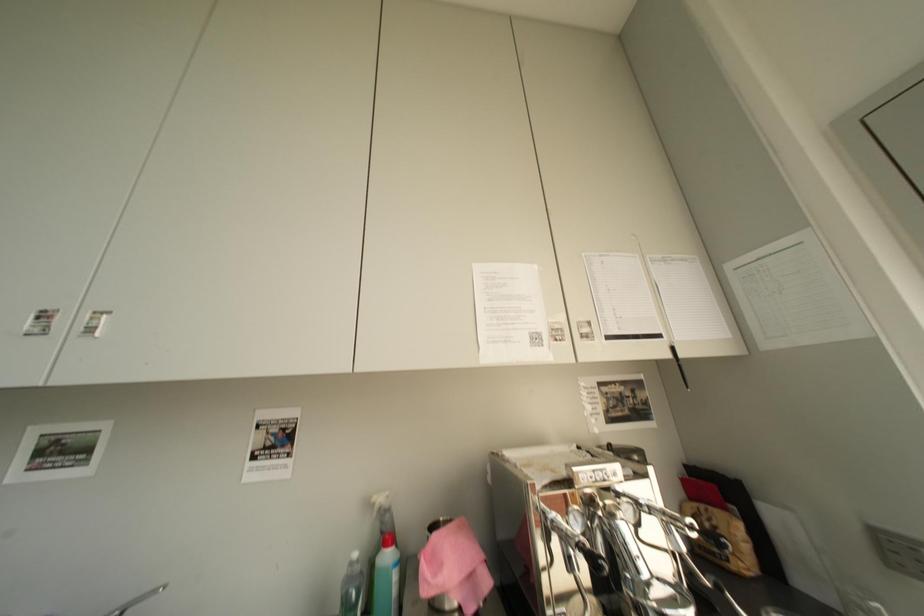
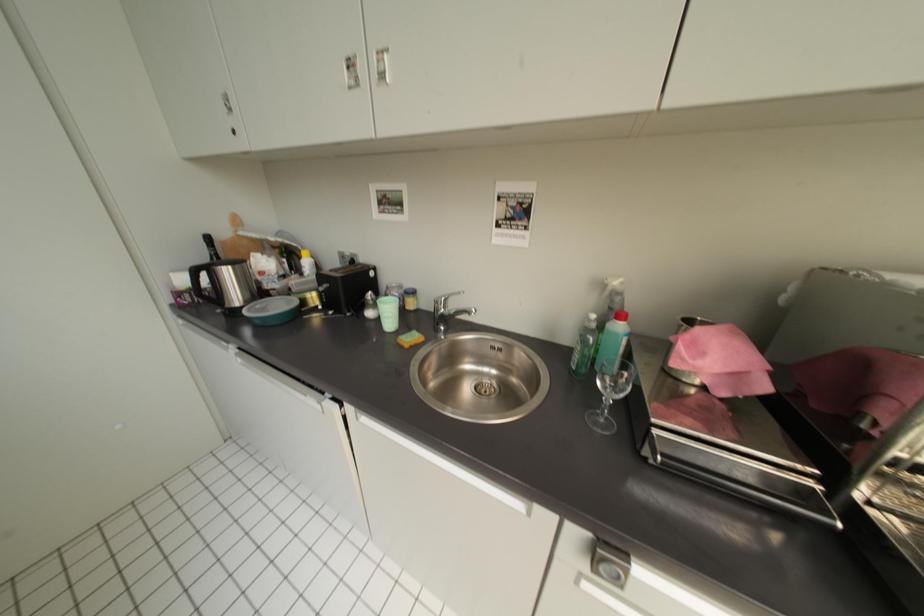
Consider the image. How did the camera likely rotate?

The camera's rotation is toward left-down.